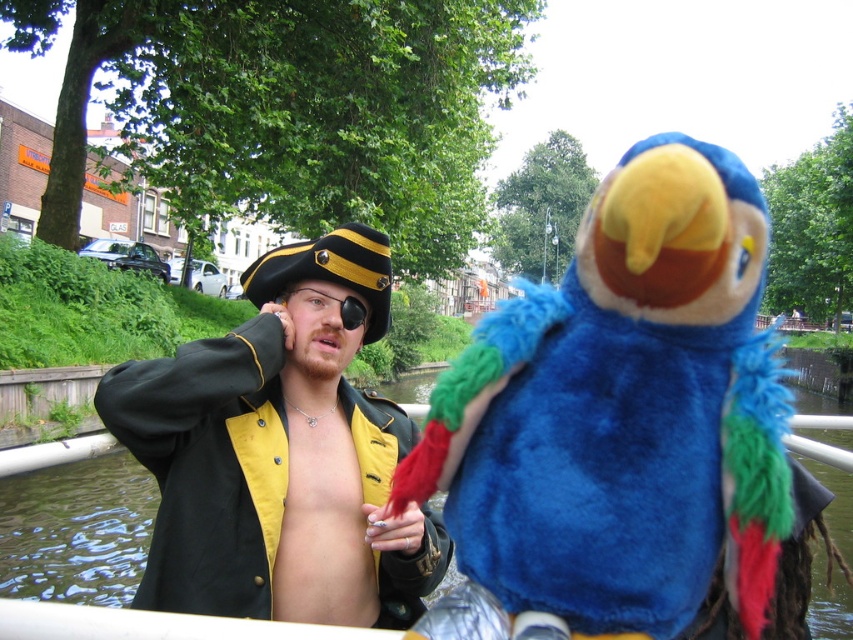
Question: Which object is farther from the camera taking this photo?

Choices:
 (A) matte black pirate hat at upper center
 (B) skinny yellow/yellowish leather at center

Answer: (B)

Question: Which object is positioned closest to the matte black pirate hat at upper center?

Choices:
 (A) skinny yellow/yellowish leather at center
 (B) blue plush parrot at upper right

Answer: (A)

Question: Does blue plush parrot at upper right come behind matte black pirate hat at upper center?

Choices:
 (A) yes
 (B) no

Answer: (B)

Question: Which of these objects is positioned farthest from the skinny yellow/yellowish leather at center?

Choices:
 (A) matte black pirate hat at upper center
 (B) blue plush parrot at upper right

Answer: (B)

Question: Is matte black pirate hat at upper center behind skinny yellow/yellowish leather at center?

Choices:
 (A) yes
 (B) no

Answer: (B)

Question: Does matte black pirate hat at upper center have a greater width compared to skinny yellow/yellowish leather at center?

Choices:
 (A) no
 (B) yes

Answer: (B)